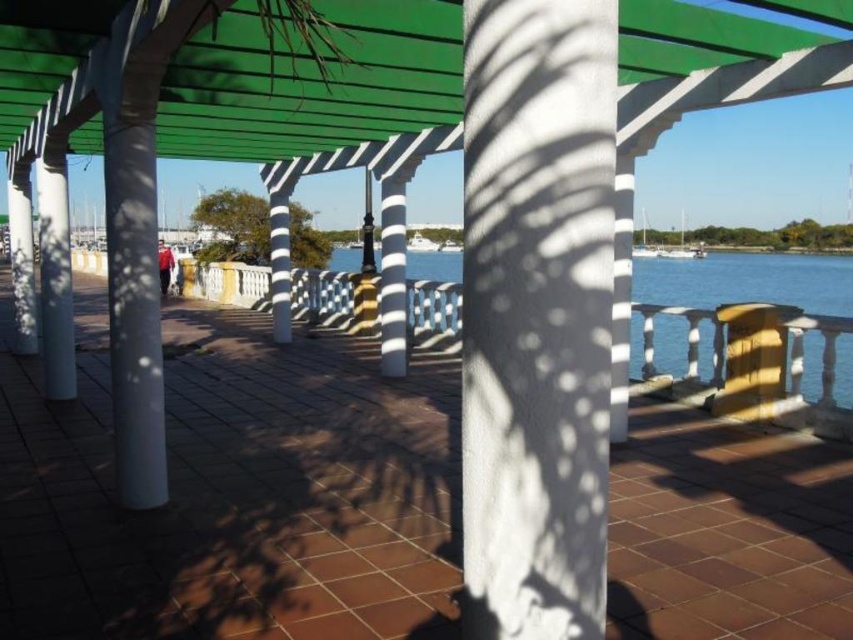
Is white textured pillar at center to the left of green plastic canopy at upper center from the viewer's perspective?

In fact, white textured pillar at center is to the right of green plastic canopy at upper center.

Which is in front, point (463, 342) or point (3, 90)?

Positioned in front is point (463, 342).

Where is `white textured pillar at center`? The image size is (853, 640). white textured pillar at center is located at coordinates (537, 314).